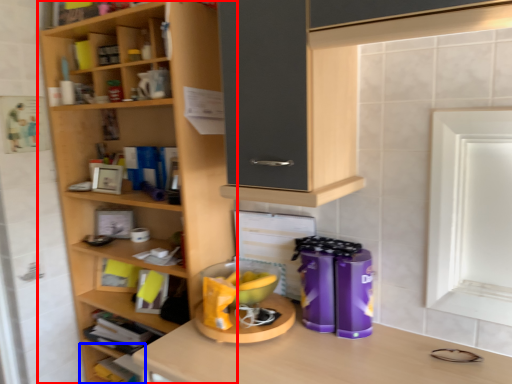
Question: Among these objects, which one is farthest to the camera, shelf (highlighted by a red box) or shelf (highlighted by a blue box)?

Choices:
 (A) shelf
 (B) shelf

Answer: (B)